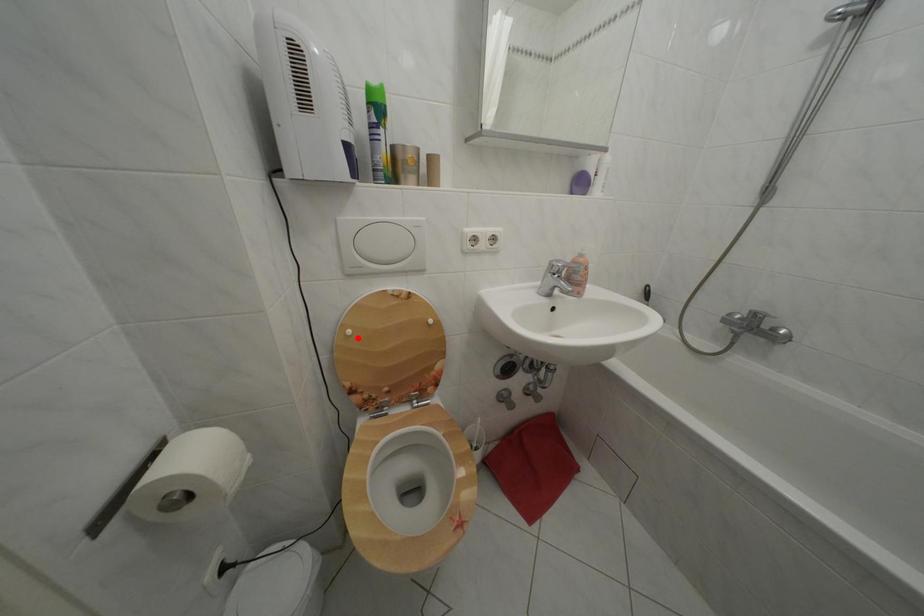
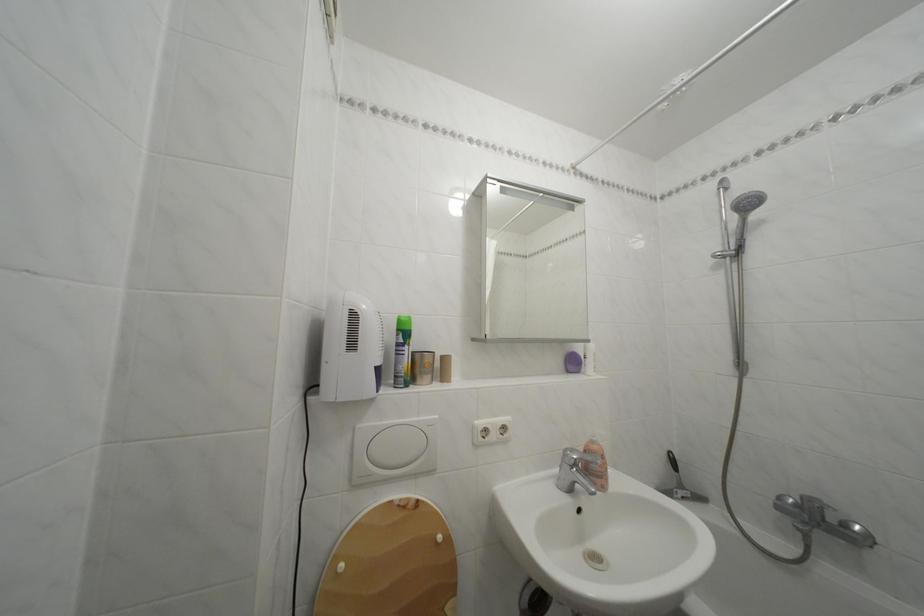
Locate, in the second image, the point that corresponds to the highlighted location in the first image.

(350, 573)